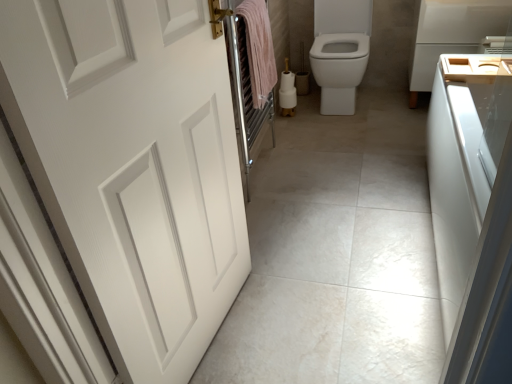
Question: From a real-world perspective, is white glossy bidet at center positioned over wooden sink at right based on gravity?

Choices:
 (A) yes
 (B) no

Answer: (B)

Question: Can you confirm if white glossy bidet at center is smaller than wooden sink at right?

Choices:
 (A) yes
 (B) no

Answer: (B)

Question: Is wooden sink at right at the back of white glossy bidet at center?

Choices:
 (A) no
 (B) yes

Answer: (A)

Question: Is white glossy bidet at center in front of wooden sink at right?

Choices:
 (A) no
 (B) yes

Answer: (A)

Question: Does white glossy bidet at center have a larger size compared to wooden sink at right?

Choices:
 (A) no
 (B) yes

Answer: (B)

Question: From a real-world perspective, is white glossy bidet at center beneath wooden sink at right?

Choices:
 (A) yes
 (B) no

Answer: (A)

Question: From a real-world perspective, is white matte door at left on top of wooden tray at right?

Choices:
 (A) no
 (B) yes

Answer: (B)

Question: Is white matte door at left surrounding wooden tray at right?

Choices:
 (A) no
 (B) yes

Answer: (A)

Question: From the image's perspective, is white matte door at left under wooden tray at right?

Choices:
 (A) no
 (B) yes

Answer: (B)

Question: Is white matte door at left facing towards wooden tray at right?

Choices:
 (A) no
 (B) yes

Answer: (A)

Question: From the image's perspective, would you say white matte door at left is positioned over wooden tray at right?

Choices:
 (A) yes
 (B) no

Answer: (B)

Question: Is white matte door at left outside of wooden tray at right?

Choices:
 (A) yes
 (B) no

Answer: (A)

Question: Does white matte door at left have a lesser width compared to white glossy bidet at center?

Choices:
 (A) no
 (B) yes

Answer: (B)